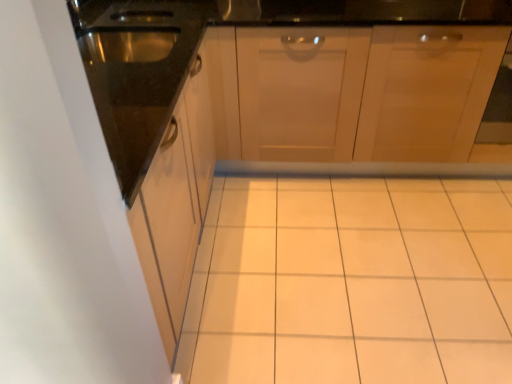
Measure the distance between white ceramic tile at center and camera.

They are 1.51 meters apart.

This screenshot has width=512, height=384. I want to click on white ceramic tile at center, so click(x=352, y=282).

Image resolution: width=512 pixels, height=384 pixels. Describe the element at coordinates (352, 282) in the screenshot. I see `white ceramic tile at center` at that location.

What is the approximate height of white ceramic tile at center?

The height of white ceramic tile at center is 2.42 inches.

Where is `white ceramic tile at center`? The image size is (512, 384). white ceramic tile at center is located at coordinates (352, 282).